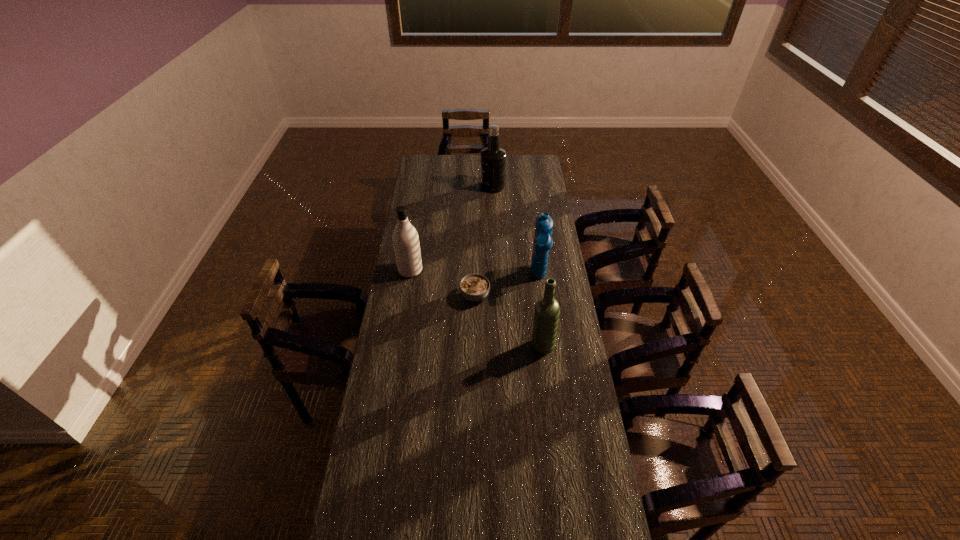
In order to click on free space between the shortest object and the left shampoo in this screenshot , I will do `click(443, 283)`.

This screenshot has width=960, height=540. I want to click on free space that is in between the leftmost object and the soup bowl, so click(x=443, y=283).

The height and width of the screenshot is (540, 960). Find the location of `vacant area that lies between the farthest object and the wine bottle`. vacant area that lies between the farthest object and the wine bottle is located at coordinates (517, 266).

Identify the location of free spot between the left shampoo and the farthest object. (451, 228).

Choose which object is the fourth nearest neighbor to the farthest object. Please provide its 2D coordinates. Your answer should be formatted as a tuple, i.e. [(x, y)], where the tuple contains the x and y coordinates of a point satisfying the conditions above.

[(546, 316)]

You are a GUI agent. You are given a task and a screenshot of the screen. Output one action in this format:
    pyautogui.click(x=<x>, y=<y>)
    Task: Click on the object that can be found as the fourth closest to the left shampoo
    The height and width of the screenshot is (540, 960).
    Given the screenshot: What is the action you would take?
    pyautogui.click(x=493, y=158)

I want to click on vacant space that satisfies the following two spatial constraints: 1. on the front label of the liquor; 2. on the left side of the right shampoo, so click(x=496, y=278).

The width and height of the screenshot is (960, 540). What are the coordinates of `free point that satisfies the following two spatial constraints: 1. on the front-facing side of the left shampoo; 2. on the back side of the nearest object` in the screenshot? It's located at (398, 346).

Locate an element on the screen. The image size is (960, 540). vacant point that satisfies the following two spatial constraints: 1. on the front label of the right shampoo; 2. on the right side of the farthest object is located at coordinates (496, 278).

In order to click on free region that satisfies the following two spatial constraints: 1. on the front label of the nearest object; 2. on the left side of the liquor in this screenshot , I will do `click(498, 346)`.